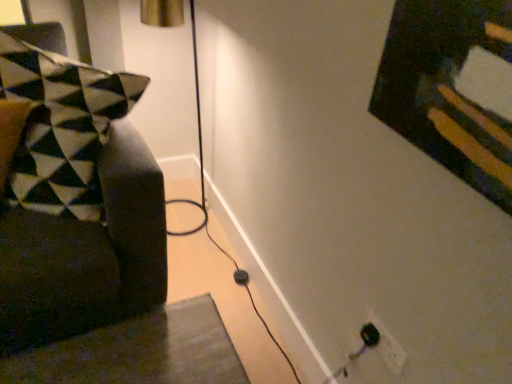
Question: From a real-world perspective, does velvet black pillow at left sit lower than black plastic electric outlet at lower right?

Choices:
 (A) yes
 (B) no

Answer: (B)

Question: From a real-world perspective, is velvet black pillow at left physically above black plastic electric outlet at lower right?

Choices:
 (A) yes
 (B) no

Answer: (A)

Question: Is velvet black pillow at left shorter than black plastic electric outlet at lower right?

Choices:
 (A) no
 (B) yes

Answer: (A)

Question: Is velvet black pillow at left to the right of black plastic electric outlet at lower right from the viewer's perspective?

Choices:
 (A) no
 (B) yes

Answer: (A)

Question: Could you tell me if velvet black pillow at left is facing black plastic electric outlet at lower right?

Choices:
 (A) no
 (B) yes

Answer: (A)

Question: Does velvet black pillow at left have a larger size compared to black plastic electric outlet at lower right?

Choices:
 (A) yes
 (B) no

Answer: (A)

Question: Is black plastic electric outlet at lower right at the left side of velvet black pillow at left?

Choices:
 (A) no
 (B) yes

Answer: (A)

Question: From a real-world perspective, is black plastic electric outlet at lower right below velvet black pillow at left?

Choices:
 (A) no
 (B) yes

Answer: (B)

Question: Can you confirm if black plastic electric outlet at lower right is positioned to the right of velvet black pillow at left?

Choices:
 (A) yes
 (B) no

Answer: (A)

Question: Would you consider black plastic electric outlet at lower right to be distant from velvet black pillow at left?

Choices:
 (A) yes
 (B) no

Answer: (B)

Question: Can you confirm if black plastic electric outlet at lower right is smaller than velvet black pillow at left?

Choices:
 (A) yes
 (B) no

Answer: (A)

Question: From the image's perspective, is black plastic electric outlet at lower right above velvet black pillow at left?

Choices:
 (A) yes
 (B) no

Answer: (B)

Question: In the image, is black plastic electric outlet at lower right positioned in front of or behind velvet black pillow at left?

Choices:
 (A) front
 (B) behind

Answer: (B)